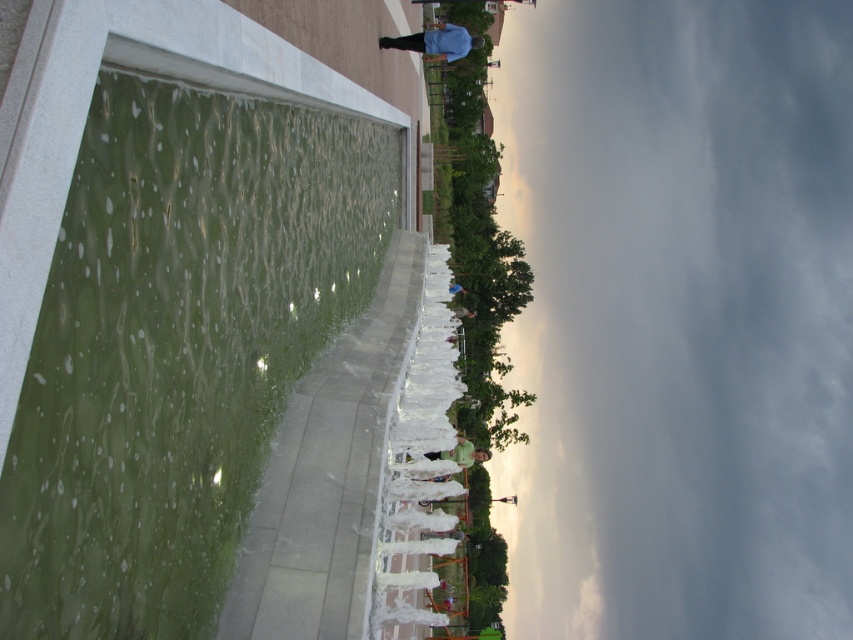
You are standing on the paved walkway next to the fountain and want to reach both points marked in the image. Which point, point (x=415, y=48) or point (x=463, y=289), is closer to you?

Point (x=415, y=48) is closer to the viewer than point (x=463, y=289).

In the scene shown: You are standing on the walkway next to the fountain and see two people wearing the green matte shirt at center and the light blue shirt at center. Which person is closer to the left side of the walkway?

The green matte shirt at center is to the left of the light blue shirt at center, so the person wearing the green matte shirt at center is closer to the left side of the walkway.

In the scene shown: What are the coordinates of the green polished stone water at left in the image?

The green polished stone water at left is located at coordinates point (177, 346).